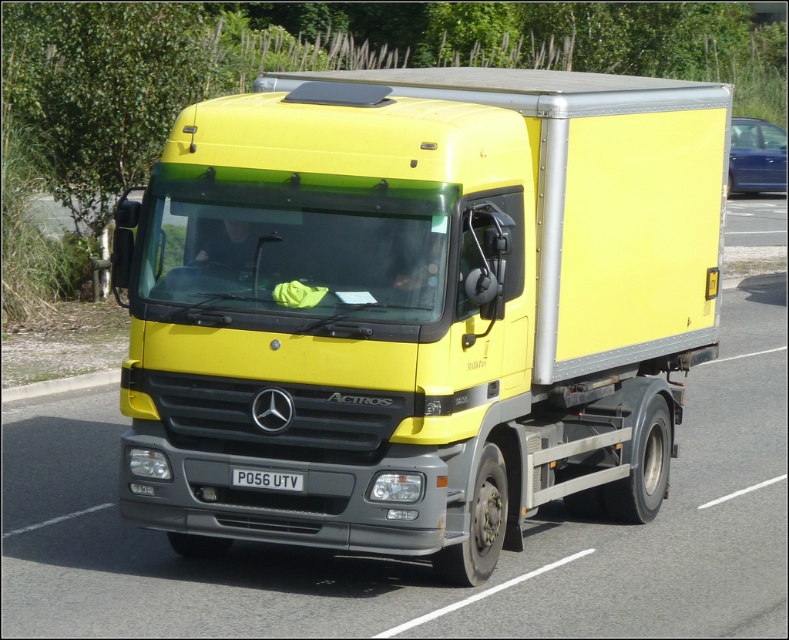
Question: Which object is closer to the camera taking this photo?

Choices:
 (A) yellow matte truck at center
 (B) black plastic license plate at center

Answer: (B)

Question: Where is yellow matte truck at center located in relation to black plastic license plate at center in the image?

Choices:
 (A) right
 (B) left

Answer: (A)

Question: Is yellow matte truck at center bigger than black plastic license plate at center?

Choices:
 (A) yes
 (B) no

Answer: (A)

Question: Which point appears closest to the camera in this image?

Choices:
 (A) (204, 340)
 (B) (290, 486)

Answer: (B)

Question: Is yellow matte truck at center further to the viewer compared to black plastic license plate at center?

Choices:
 (A) yes
 (B) no

Answer: (A)